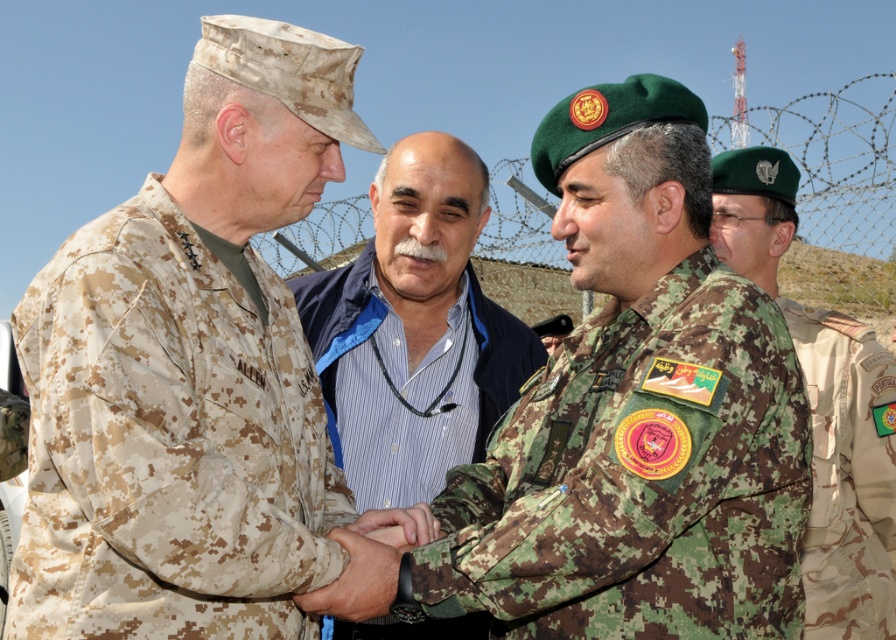
Question: Which point appears closest to the camera in this image?

Choices:
 (A) (332, 440)
 (B) (828, 464)

Answer: (B)

Question: In this image, where is camouflage uniform at center located relative to camouflage fabric uniform at right?

Choices:
 (A) below
 (B) above

Answer: (B)

Question: Based on their relative distances, which object is nearer to the camouflage fabric uniform at right?

Choices:
 (A) camouflage fabric uniform at center
 (B) camouflage uniform at left
 (C) blue striped shirt at center
 (D) camouflage uniform at center

Answer: (D)

Question: Is blue striped shirt at center thinner than camouflage uniform at center?

Choices:
 (A) no
 (B) yes

Answer: (A)

Question: Is camouflage fabric uniform at center further to the viewer compared to blue striped shirt at center?

Choices:
 (A) no
 (B) yes

Answer: (A)

Question: Which object is positioned farthest from the camouflage uniform at center?

Choices:
 (A) blue striped shirt at center
 (B) camouflage uniform at left
 (C) camouflage fabric uniform at right
 (D) camouflage fabric uniform at center

Answer: (B)